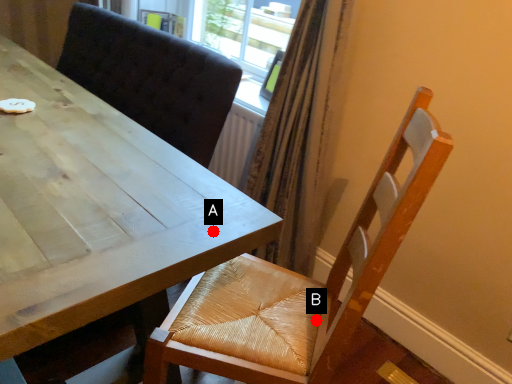
Question: Two points are circled on the image, labeled by A and B beside each circle. Which of the following is the farthest from the observer?

Choices:
 (A) A is further
 (B) B is further

Answer: (B)